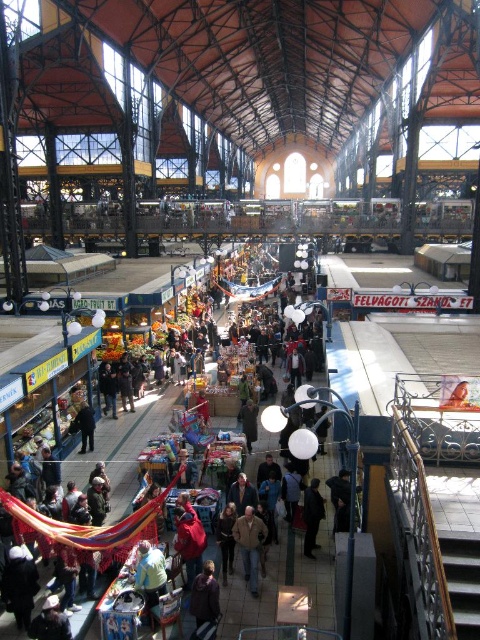
Can you confirm if dark brown leather jacket at center is smaller than brown leather jacket at center?

No, dark brown leather jacket at center is not smaller than brown leather jacket at center.

Who is shorter, dark brown leather jacket at center or brown leather jacket at center?

brown leather jacket at center

Is point (194, 600) farther from camera compared to point (239, 522)?

That is False.

Find the location of a particular element. The image size is (480, 640). dark brown leather jacket at center is located at coordinates (204, 602).

Can you confirm if brown leather jacket at center is smaller than dark blue fabric at center?

No.

Does brown leather jacket at center come behind dark blue fabric at center?

No.

Is point (253, 547) positioned before point (317, 490)?

Yes, it is.

This screenshot has height=640, width=480. I want to click on brown leather jacket at center, so click(x=250, y=545).

How distant is brown leather jacket at center from light blue fabric at center?

brown leather jacket at center and light blue fabric at center are 22.68 feet apart from each other.

Does brown leather jacket at center have a lesser width compared to light blue fabric at center?

Yes, brown leather jacket at center is thinner than light blue fabric at center.

Locate an element on the screen. Image resolution: width=480 pixels, height=640 pixels. brown leather jacket at center is located at coordinates (250, 545).

At what (x,y) coordinates should I click in order to perform the action: click on brown leather jacket at center. Please return your answer as a coordinate pair (x, y). The height and width of the screenshot is (640, 480). Looking at the image, I should click on (250, 545).